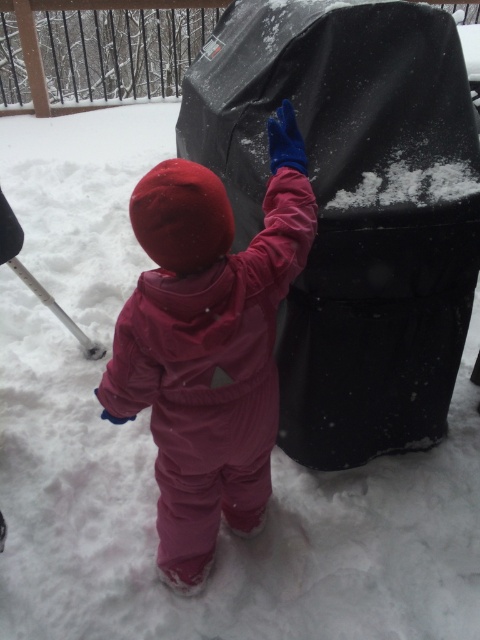
Based on the photo, which is more to the right, black matte grill at center or matte pink snowsuit at center?

Positioned to the right is black matte grill at center.

Is black matte grill at center smaller than matte pink snowsuit at center?

No, black matte grill at center is not smaller than matte pink snowsuit at center.

This screenshot has width=480, height=640. I want to click on black matte grill at center, so coord(352,209).